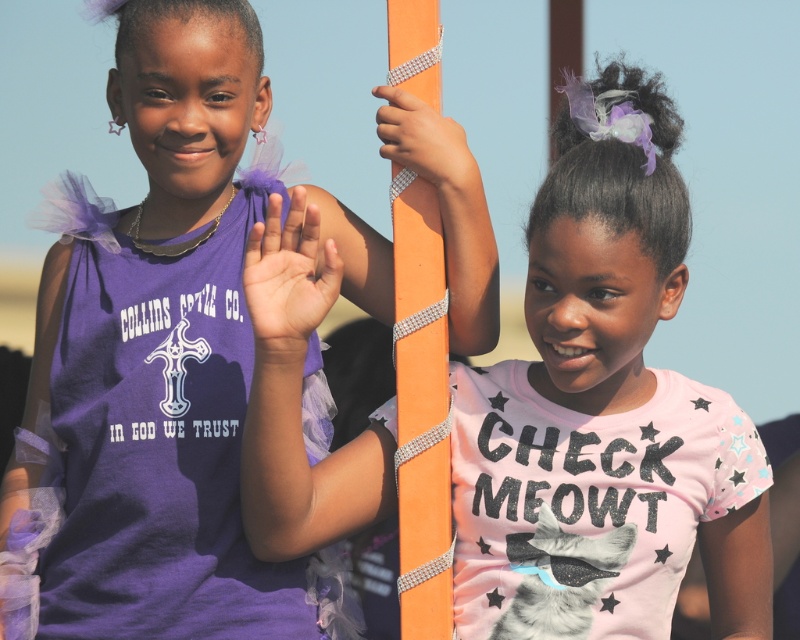
The height and width of the screenshot is (640, 800). Describe the element at coordinates (604, 420) in the screenshot. I see `pink glittery shirt at center` at that location.

Who is more distant from viewer, (568,280) or (244,573)?

Point (244,573)

Where is `pink glittery shirt at center`? This screenshot has width=800, height=640. pink glittery shirt at center is located at coordinates (604, 420).

Find the location of a particular element. The height and width of the screenshot is (640, 800). pink glittery shirt at center is located at coordinates (604, 420).

Based on the photo, is pink glittery shirt at center above matte purple hand at center?

Actually, pink glittery shirt at center is below matte purple hand at center.

Identify the location of pink glittery shirt at center. The height and width of the screenshot is (640, 800). (604, 420).

Between point (206, 444) and point (276, 348), which one is positioned behind?

The point (206, 444) is more distant.

Does purple tulle dress at left come behind matte purple hand at center?

That is True.

Between point (92, 488) and point (254, 300), which one is positioned behind?

Point (92, 488)

At what (x,y) coordinates should I click in order to perform the action: click on purple tulle dress at left. Please return your answer as a coordinate pair (x, y). The image size is (800, 640). Looking at the image, I should click on (162, 355).